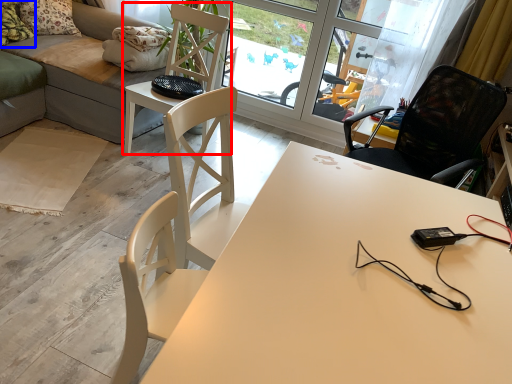
Question: Which point is closer to the camera, chair (highlighted by a red box) or pillow (highlighted by a blue box)?

Choices:
 (A) chair
 (B) pillow

Answer: (A)